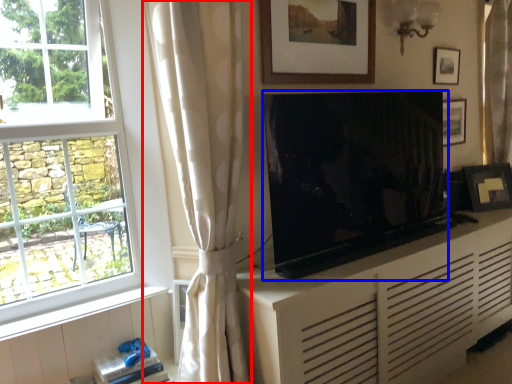
Question: Which of the following is the closest to the observer, curtain (highlighted by a red box) or television (highlighted by a blue box)?

Choices:
 (A) curtain
 (B) television

Answer: (A)